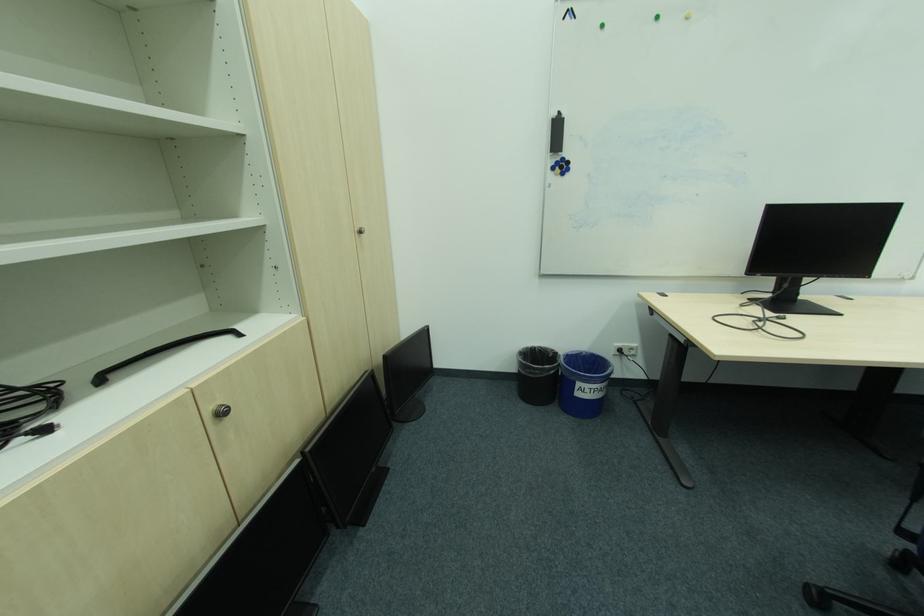
Which object does [222,411] point to?

This point indicates the black cabinet handle.